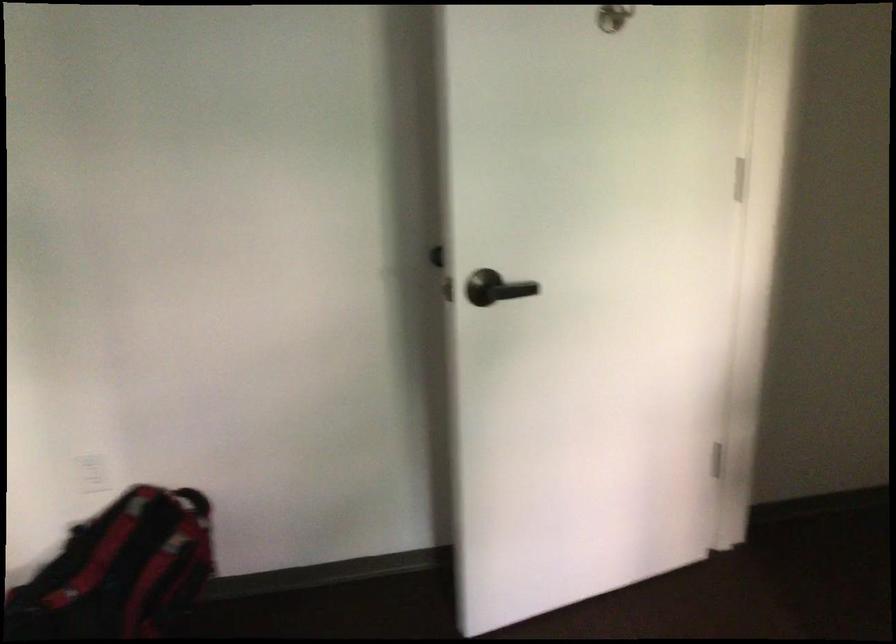
Describe the element at coordinates (495, 288) in the screenshot. I see `the black door handle` at that location.